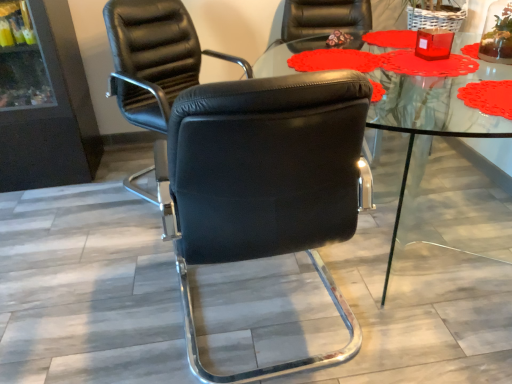
Identify the location of vacant area situated to the left side of black leather chair at center, the second chair when ordered from back to front. The image size is (512, 384). (111, 299).